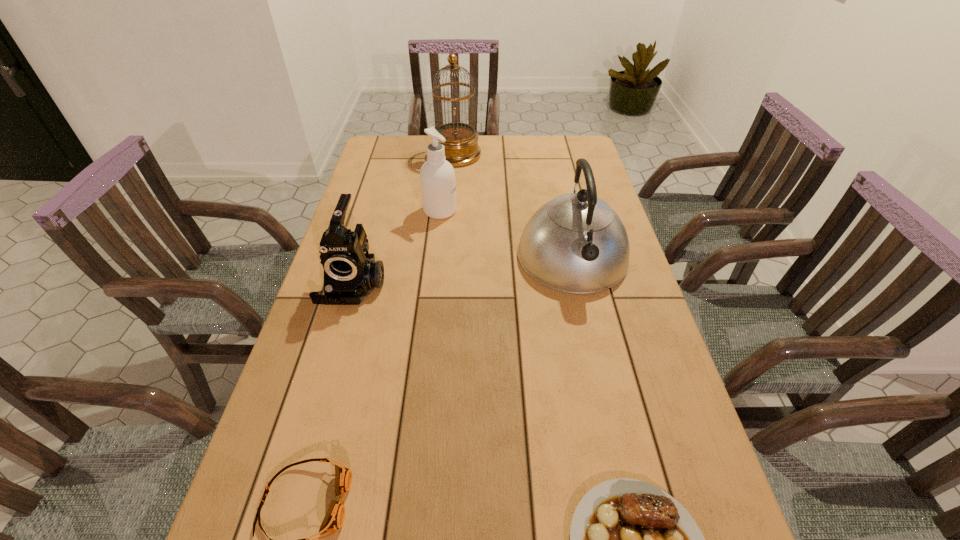
Find the location of a particular element. object that is at the left edge is located at coordinates (350, 274).

Identify the location of object that is at the right edge. The image size is (960, 540). (576, 243).

This screenshot has width=960, height=540. I want to click on free space at the far edge of the desktop, so click(498, 153).

Where is `vacant space at the left edge of the desktop`? vacant space at the left edge of the desktop is located at coordinates point(383,249).

Where is `vacant space at the right edge`? Image resolution: width=960 pixels, height=540 pixels. vacant space at the right edge is located at coordinates (636, 372).

Locate an element on the screen. This screenshot has width=960, height=540. free space at the far left corner of the desktop is located at coordinates (402, 146).

At what (x,y) coordinates should I click in order to perform the action: click on free location at the far right corner. Please return your answer as a coordinate pair (x, y). This screenshot has height=540, width=960. Looking at the image, I should click on (563, 140).

Locate an element on the screen. This screenshot has height=540, width=960. blank region between the fifth nearest object and the camcorder is located at coordinates [396, 247].

Locate an element on the screen. This screenshot has height=540, width=960. vacant area that lies between the camcorder and the farthest object is located at coordinates (405, 219).

The width and height of the screenshot is (960, 540). Identify the location of free spot between the kettle and the tallest object. (515, 206).